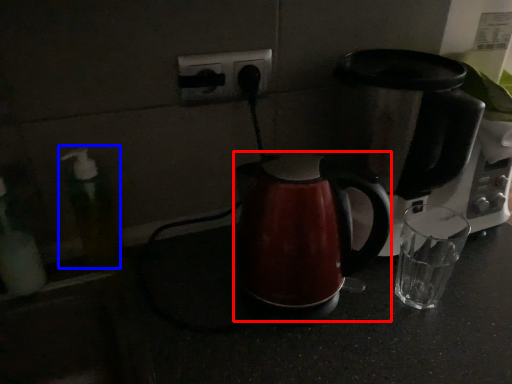
Question: Among these objects, which one is nearest to the camera, kettle (highlighted by a red box) or soap dispenser (highlighted by a blue box)?

Choices:
 (A) kettle
 (B) soap dispenser

Answer: (A)